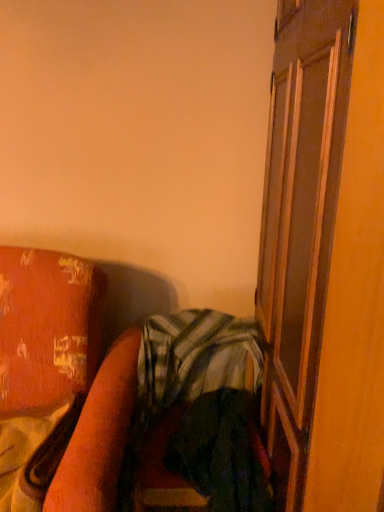
What do you see at coordinates (43, 365) in the screenshot?
I see `wooden bed frame at lower left` at bounding box center [43, 365].

Locate an element on the screen. Image resolution: width=384 pixels, height=512 pixels. wooden bed frame at lower left is located at coordinates (43, 365).

From a real-world perspective, relative to green striped fabric at center, is brown wooden screen door at right vertically above or below?

In terms of real-world spatial position, brown wooden screen door at right is above green striped fabric at center.

Identify the location of screen door above the green striped fabric at center (from a real-world perspective). (325, 256).

Is brown wooden screen door at right completely or partially outside of green striped fabric at center?

brown wooden screen door at right is positioned outside green striped fabric at center.

In terms of height, does brown wooden screen door at right look taller or shorter compared to green striped fabric at center?

In the image, brown wooden screen door at right appears to be taller than green striped fabric at center.

Does wooden bed frame at lower left appear on the right side of green striped fabric at center?

Incorrect, wooden bed frame at lower left is not on the right side of green striped fabric at center.

Does wooden bed frame at lower left lie in front of green striped fabric at center?

Yes, it is.

Considering the relative sizes of wooden bed frame at lower left and green striped fabric at center in the image provided, is wooden bed frame at lower left taller than green striped fabric at center?

Yes, wooden bed frame at lower left is taller than green striped fabric at center.

Looking at this image, who is taller, wooden bed frame at lower left or brown wooden screen door at right?

With more height is brown wooden screen door at right.

Is wooden bed frame at lower left in front of or behind brown wooden screen door at right in the image?

Visually, wooden bed frame at lower left is located behind brown wooden screen door at right.

Which is farther from the camera, (x=10, y=268) or (x=299, y=312)?

The point (x=10, y=268) is farther from the camera.

Who is smaller, wooden bed frame at lower left or brown wooden screen door at right?

wooden bed frame at lower left is smaller.

Identify the location of screen door above the wooden bed frame at lower left (from the image's perspective). (325, 256).

Considering the sizes of objects brown wooden screen door at right and wooden bed frame at lower left in the image provided, who is shorter, brown wooden screen door at right or wooden bed frame at lower left?

With less height is wooden bed frame at lower left.

Would you say brown wooden screen door at right contains wooden bed frame at lower left?

No, wooden bed frame at lower left is not a part of brown wooden screen door at right.

How much distance is there between brown wooden screen door at right and wooden bed frame at lower left?

The distance of brown wooden screen door at right from wooden bed frame at lower left is 30.75 inches.

How many degrees apart are the facing directions of green striped fabric at center and wooden bed frame at lower left?

The facing directions of green striped fabric at center and wooden bed frame at lower left are 0.778 degrees apart.

From the image's perspective, is green striped fabric at center located beneath wooden bed frame at lower left?

Actually, green striped fabric at center appears above wooden bed frame at lower left in the image.

Considering the positions of objects green striped fabric at center and wooden bed frame at lower left in the image provided, who is more to the left, green striped fabric at center or wooden bed frame at lower left?

From the viewer's perspective, wooden bed frame at lower left appears more on the left side.

Find the location of a particular element. furniture lying below the green striped fabric at center (from the image's perspective) is located at coordinates (43, 365).

Does green striped fabric at center have a greater height compared to brown wooden screen door at right?

In fact, green striped fabric at center may be shorter than brown wooden screen door at right.

At what (x,y) coordinates should I click in order to perform the action: click on screen door in front of the green striped fabric at center. Please return your answer as a coordinate pair (x, y). Image resolution: width=384 pixels, height=512 pixels. Looking at the image, I should click on (325, 256).

Relative to brown wooden screen door at right, is green striped fabric at center in front or behind?

Clearly, green striped fabric at center is behind brown wooden screen door at right.

I want to click on plaid located behind the brown wooden screen door at right, so click(x=195, y=358).

Where is `furniture that appears in front of the green striped fabric at center`? This screenshot has height=512, width=384. furniture that appears in front of the green striped fabric at center is located at coordinates pyautogui.click(x=43, y=365).

Considering their positions, is wooden bed frame at lower left positioned further to green striped fabric at center than brown wooden screen door at right?

The object further to green striped fabric at center is brown wooden screen door at right.

Estimate the real-world distances between objects in this image. Which object is further from wooden bed frame at lower left, green striped fabric at center or brown wooden screen door at right?

The object further to wooden bed frame at lower left is brown wooden screen door at right.

Looking at the image, which one is located further to wooden bed frame at lower left, brown wooden screen door at right or green striped fabric at center?

brown wooden screen door at right.

Looking at the image, which one is located closer to brown wooden screen door at right, green striped fabric at center or wooden bed frame at lower left?

Among the two, green striped fabric at center is located nearer to brown wooden screen door at right.

Looking at the image, which one is located closer to green striped fabric at center, brown wooden screen door at right or wooden bed frame at lower left?

wooden bed frame at lower left is positioned closer to the anchor green striped fabric at center.

Considering their positions, is wooden bed frame at lower left positioned closer to brown wooden screen door at right than green striped fabric at center?

green striped fabric at center lies closer to brown wooden screen door at right than the other object.

The height and width of the screenshot is (512, 384). I want to click on plaid between wooden bed frame at lower left and brown wooden screen door at right, so click(x=195, y=358).